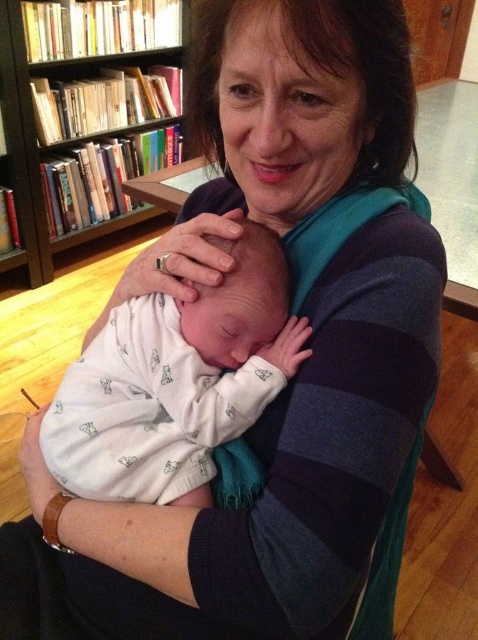
Can you confirm if white soft swaddle at center is smaller than wooden bookcase at upper left?

Yes.

Who is positioned more to the left, white soft swaddle at center or wooden bookcase at upper left?

wooden bookcase at upper left

What do you see at coordinates (175, 381) in the screenshot? This screenshot has height=640, width=478. I see `white soft swaddle at center` at bounding box center [175, 381].

Locate an element on the screen. white soft swaddle at center is located at coordinates (175, 381).